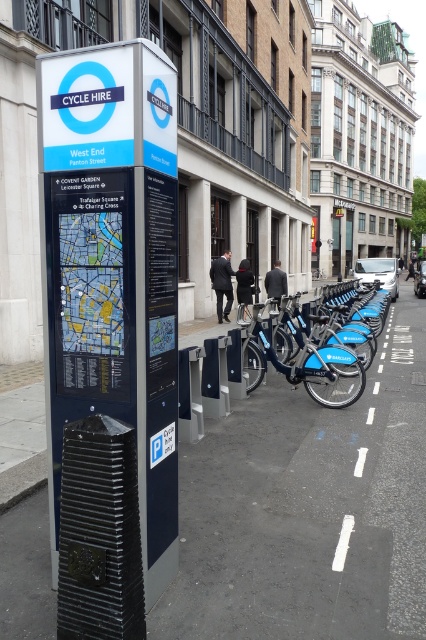
Between black rubber pavement at lower center and metallic blue sign at center, which one is positioned lower?

Positioned lower is black rubber pavement at lower center.

Can you confirm if black rubber pavement at lower center is taller than metallic blue sign at center?

Incorrect, black rubber pavement at lower center's height is not larger of metallic blue sign at center's.

Identify the location of black rubber pavement at lower center. Image resolution: width=426 pixels, height=640 pixels. click(x=308, y=509).

Who is shorter, metallic blue sign at center or blue matte bicycle at center?

blue matte bicycle at center

What do you see at coordinates (112, 268) in the screenshot? I see `metallic blue sign at center` at bounding box center [112, 268].

Which is behind, point (132, 154) or point (331, 406)?

The point (331, 406) is behind.

Identify the location of metallic blue sign at center. [x=112, y=268].

Is black rubber pavement at lower center in front of blue metallic bicycle at center?

Yes, black rubber pavement at lower center is in front of blue metallic bicycle at center.

Is point (348, 532) closer to camera compared to point (296, 333)?

Yes, point (348, 532) is in front of point (296, 333).

Where is `black rubber pavement at lower center`? black rubber pavement at lower center is located at coordinates (308, 509).